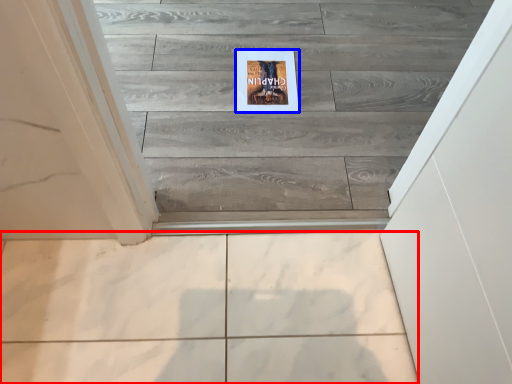
Question: Which point is further to the camera, ceramic tile (highlighted by a red box) or postcard (highlighted by a blue box)?

Choices:
 (A) ceramic tile
 (B) postcard

Answer: (B)